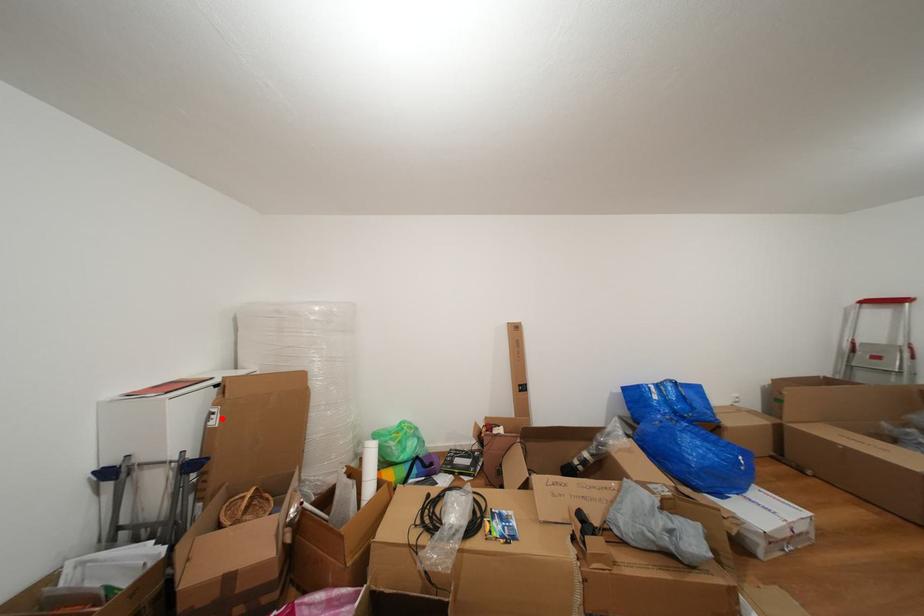
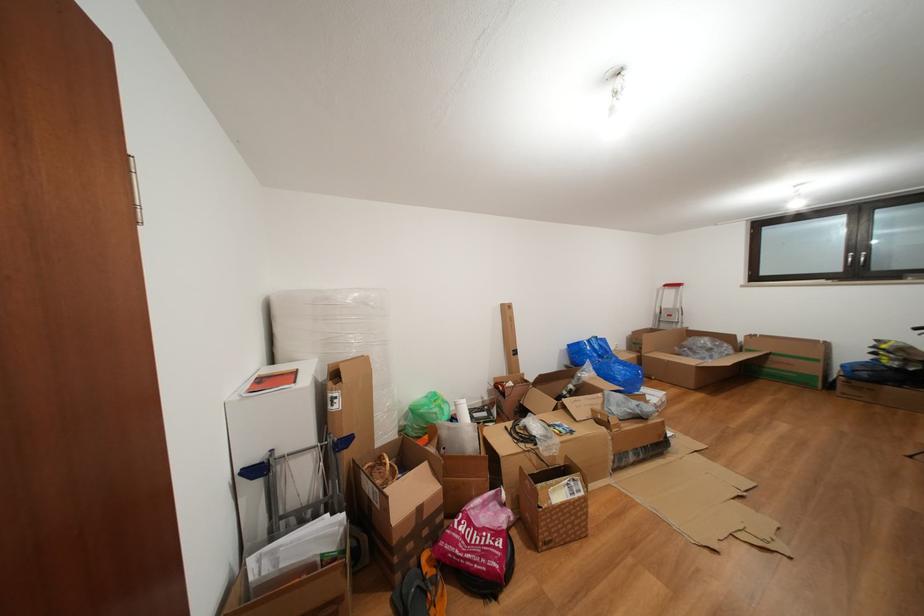
Locate, in the second image, the point that corresponds to the highlighted location in the first image.

(344, 403)